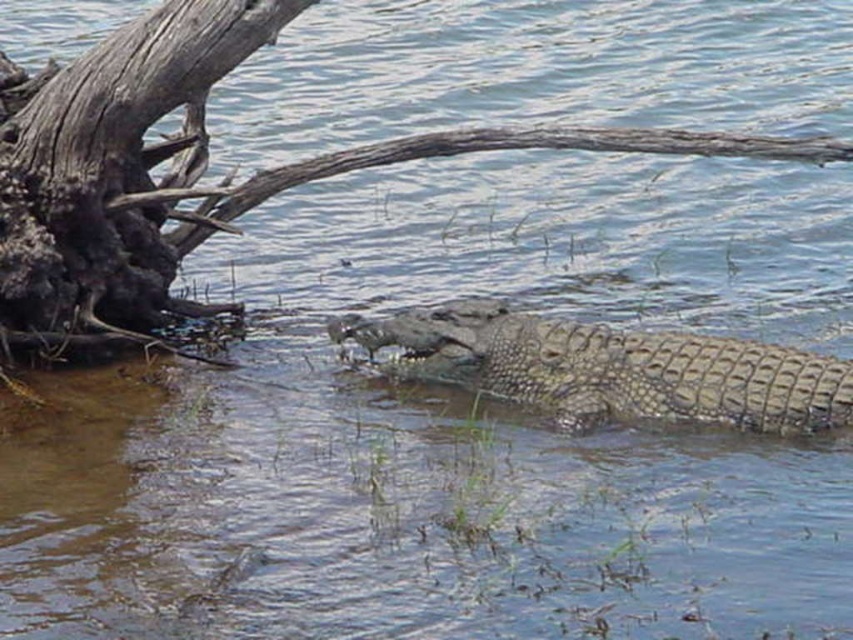
Question: From the image, what is the correct spatial relationship of textured brown crocodile at center in relation to gray rough wood log at upper center?

Choices:
 (A) above
 (B) below

Answer: (B)

Question: Among these objects, which one is farthest from the camera?

Choices:
 (A) dark brown rough wood at left
 (B) textured brown crocodile at center
 (C) gray rough wood log at upper center

Answer: (C)

Question: Which point is closer to the camera?

Choices:
 (A) textured brown crocodile at center
 (B) dark brown rough wood at left

Answer: (B)

Question: Does dark brown rough wood at left appear over gray rough wood log at upper center?

Choices:
 (A) no
 (B) yes

Answer: (A)

Question: Does dark brown rough wood at left have a larger size compared to gray rough wood log at upper center?

Choices:
 (A) yes
 (B) no

Answer: (A)

Question: Which of the following is the farthest from the observer?

Choices:
 (A) gray rough wood log at upper center
 (B) dark brown rough wood at left
 (C) textured brown crocodile at center

Answer: (A)